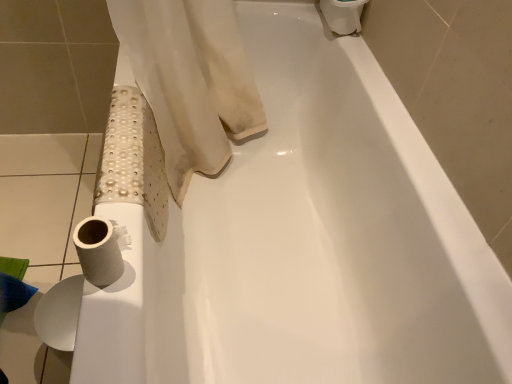
Question: Considering the positions of white matte toilet paper at lower left, the 3th toilet paper in the back-to-front sequence, and white matte toilet paper at lower left, arranged as the 2th toilet paper when viewed from the front, in the image, is white matte toilet paper at lower left, the 3th toilet paper in the back-to-front sequence, bigger or smaller than white matte toilet paper at lower left, arranged as the 2th toilet paper when viewed from the front,?

Choices:
 (A) small
 (B) big

Answer: (A)

Question: From the image's perspective, is white matte toilet paper at lower left, the 3th toilet paper in the back-to-front sequence, located above or below white matte toilet paper at lower left, the 3th toilet paper in the right-to-left sequence?

Choices:
 (A) above
 (B) below

Answer: (A)

Question: Estimate the real-world distances between objects in this image. Which object is closer to the white matte toilet paper at upper right, the 1th toilet paper viewed from the top?

Choices:
 (A) white matte toilet paper at lower left, acting as the first toilet paper starting from the bottom
 (B) white matte toilet paper at lower left, which is the second toilet paper in top-to-bottom order

Answer: (B)

Question: Considering the real-world distances, which object is closest to the white matte toilet paper at lower left, arranged as the 2th toilet paper when viewed from the front?

Choices:
 (A) white matte toilet paper at upper right, the 1th toilet paper viewed from the top
 (B) white matte toilet paper at lower left, acting as the 2th toilet paper starting from the bottom

Answer: (B)